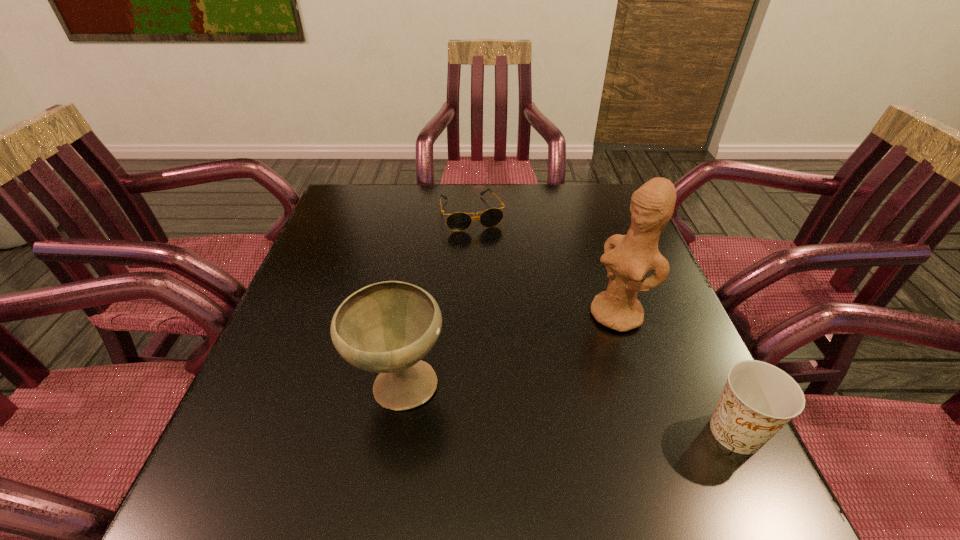
Where is `vacant position located 0.360m on the front-facing side of the second farthest object`? This screenshot has height=540, width=960. vacant position located 0.360m on the front-facing side of the second farthest object is located at coordinates click(475, 433).

I want to click on free location located 0.060m on the front-facing side of the second farthest object, so (x=582, y=345).

The height and width of the screenshot is (540, 960). Identify the location of vacant space located on the lenses of the shortest object. (507, 308).

Locate an element on the screen. vacant space located on the lenses of the shortest object is located at coordinates (517, 338).

Identify the location of vacant space located on the lenses of the shortest object. (493, 272).

This screenshot has height=540, width=960. Find the location of `object situated at the far edge`. object situated at the far edge is located at coordinates (458, 221).

In order to click on chalice present at the near edge in this screenshot , I will do `click(388, 327)`.

Locate an element on the screen. The width and height of the screenshot is (960, 540). Dixie cup that is positioned at the near edge is located at coordinates (759, 399).

Locate an element on the screen. This screenshot has width=960, height=540. Dixie cup that is at the right edge is located at coordinates pyautogui.click(x=759, y=399).

I want to click on figurine located at the right edge, so click(x=628, y=258).